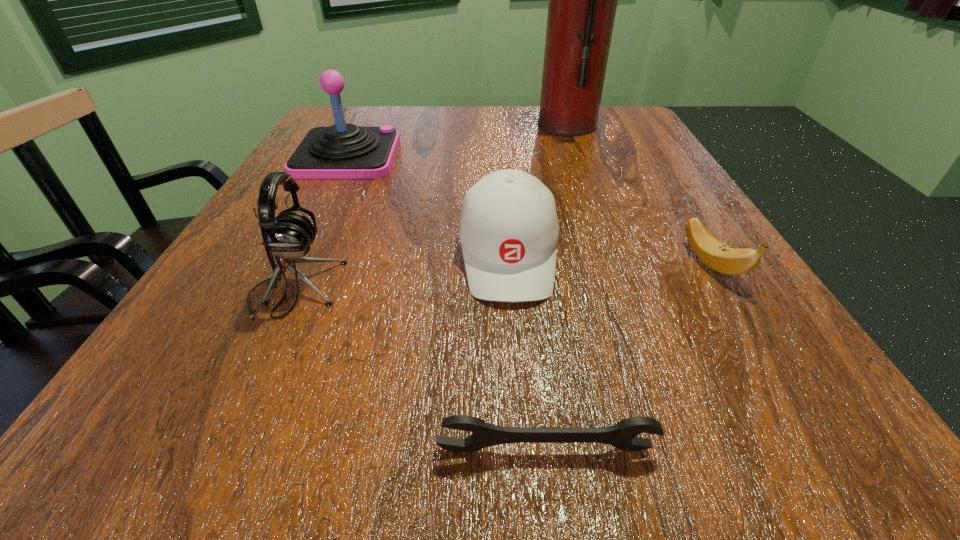
In order to click on vacant space situated 0.090m at the nozzle of the fire extinguisher in this screenshot , I will do `click(502, 125)`.

Where is `vacant region located 0.330m forward from the base of the joystick`? This screenshot has width=960, height=540. vacant region located 0.330m forward from the base of the joystick is located at coordinates (547, 156).

I want to click on vacant space located 0.290m on the right of the earphone, so click(539, 289).

This screenshot has height=540, width=960. What are the coordinates of `vacant space located 0.190m on the front-facing side of the third shortest object` in the screenshot? It's located at (522, 436).

In order to click on free space located on the left of the rightmost object in this screenshot , I will do `click(641, 264)`.

Find the location of a particular element. Image resolution: width=960 pixels, height=540 pixels. fire extinguisher that is at the far edge is located at coordinates (583, 0).

This screenshot has height=540, width=960. I want to click on joystick situated at the far edge, so [x=342, y=151].

The width and height of the screenshot is (960, 540). I want to click on object that is at the near edge, so click(x=621, y=435).

The image size is (960, 540). I want to click on joystick that is at the left edge, so click(342, 151).

Find the location of a particular element. earphone that is at the left edge is located at coordinates (288, 236).